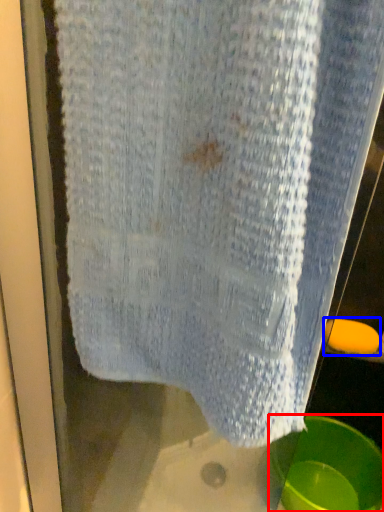
Question: Which point is further to the camera, basin (highlighted by a red box) or soap (highlighted by a blue box)?

Choices:
 (A) basin
 (B) soap

Answer: (B)